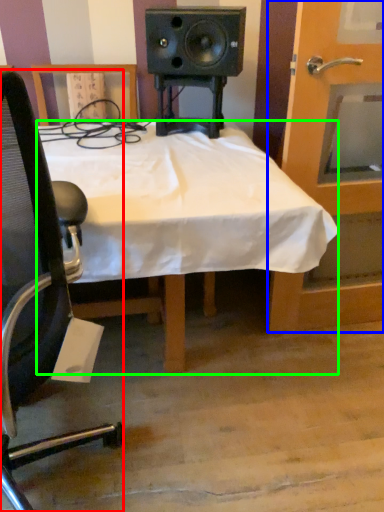
Question: Considering the real-world distances, which object is closest to chair (highlighted by a red box)? door (highlighted by a blue box) or desk (highlighted by a green box).

Choices:
 (A) door
 (B) desk

Answer: (B)